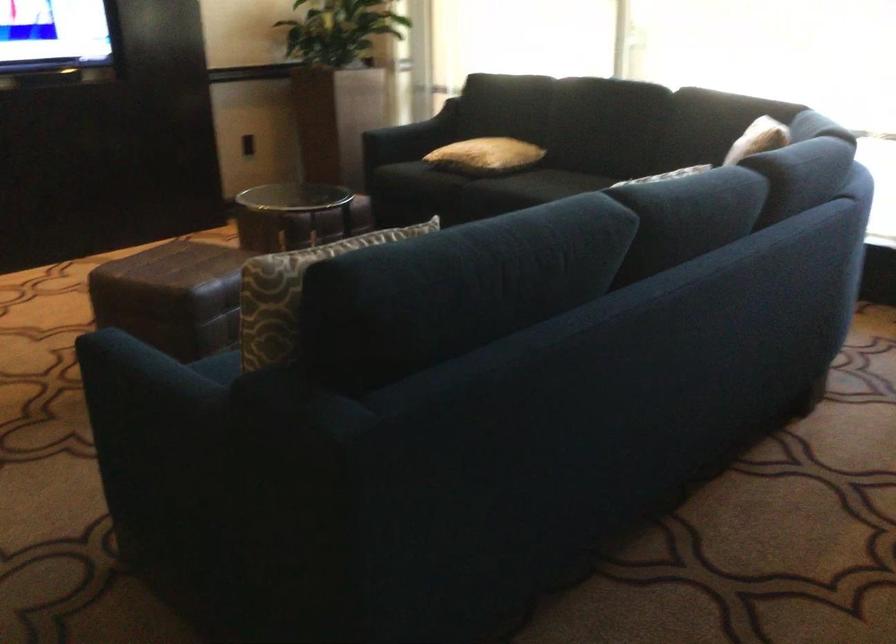
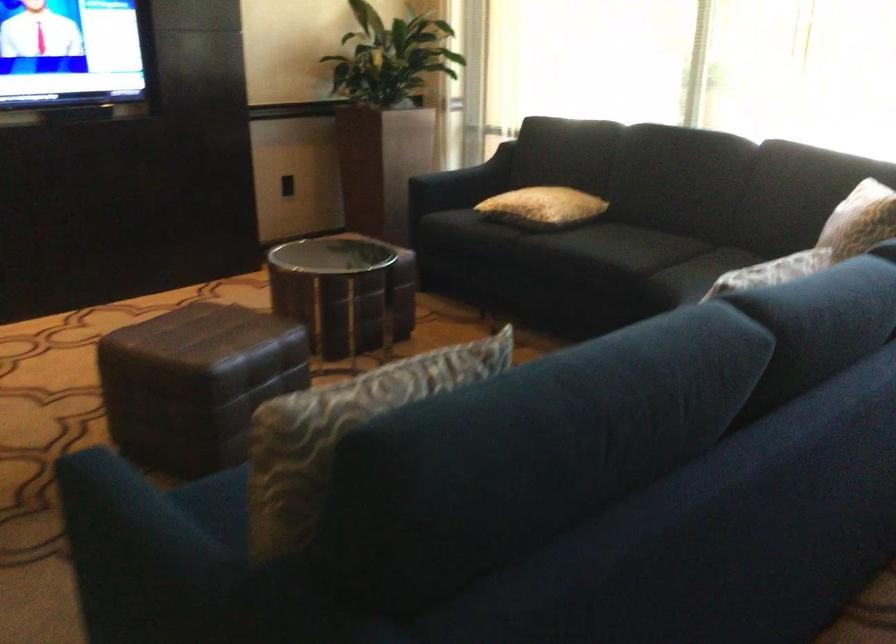
The point at (752, 149) is marked in the first image. Where is the corresponding point in the second image?

(859, 220)